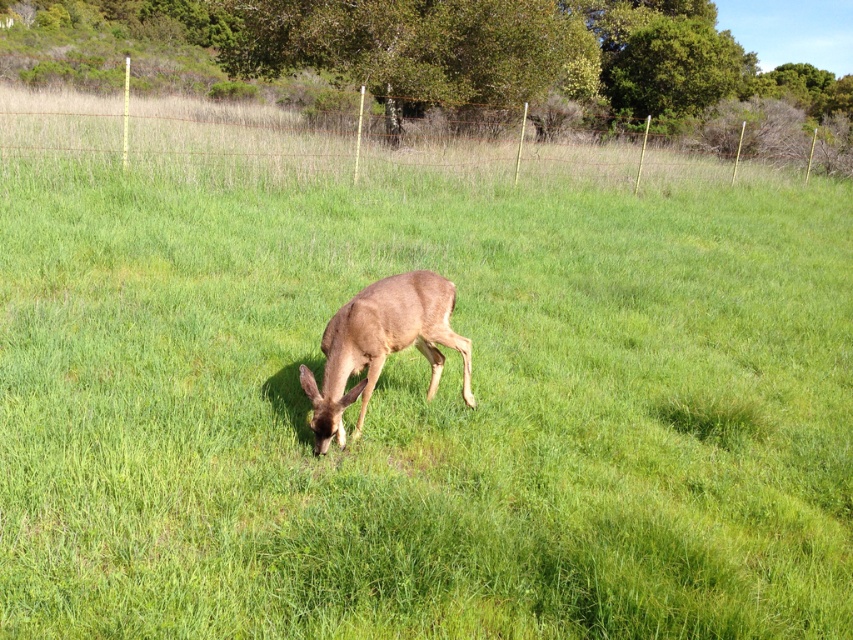
You are a farmer checking the perimeter of your field. You notice a brown wire fence at upper center and a brown matte deer at center. Which object is positioned higher in the image?

The brown wire fence at upper center is located above the brown matte deer at center, so it is positioned higher in the image.

You are a photographer standing in the field and want to take a picture of the brown matte deer at center. However, you notice the brown wire fence at upper center might block your view. Based on their positions, can you still capture the deer clearly without the fence obstructing it?

The brown wire fence at upper center is further to the viewer than the brown matte deer at center, so the deer is closer to you. This means the fence is behind the deer and won not block your view, allowing you to capture the deer clearly.

You are a farmer checking the perimeter of your field. You notice the brown wire fence at upper center and the brown matte deer at center. Which object is wider in terms of physical dimensions?

The brown wire fence at upper center is wider than the brown matte deer at center according to the description.